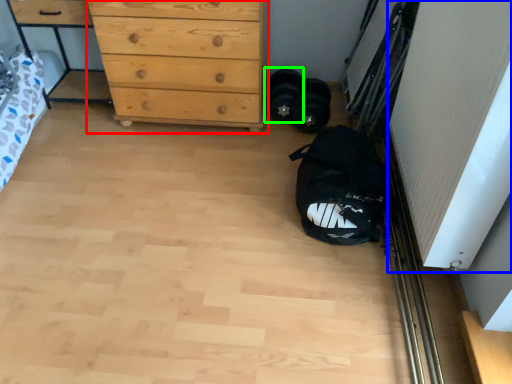
Question: Considering the real-world distances, which object is closest to chest of drawers (highlighted by a red box)? screen door (highlighted by a blue box) or footwear (highlighted by a green box).

Choices:
 (A) screen door
 (B) footwear

Answer: (B)